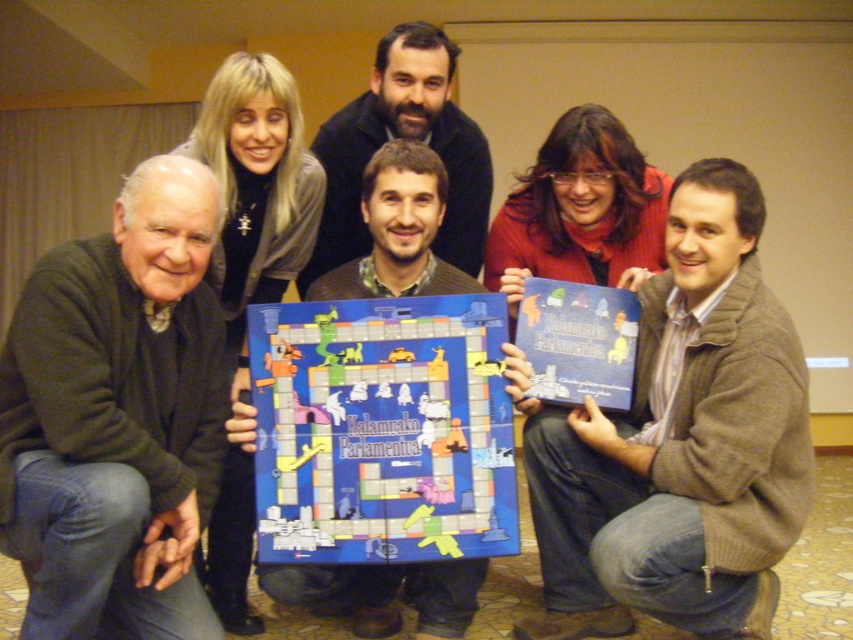
Question: Estimate the real-world distances between objects in this image. Which object is farther from the brown textured sweater at center?

Choices:
 (A) bearded man at center
 (B) dark green sweater at lower left

Answer: (A)

Question: Does dark green sweater at lower left appear over brown textured sweater at center?

Choices:
 (A) no
 (B) yes

Answer: (B)

Question: Can you confirm if brown sweater at center is positioned to the left of dark green sweater at lower left?

Choices:
 (A) no
 (B) yes

Answer: (A)

Question: Does brown textured sweater at center have a larger size compared to bearded man at center?

Choices:
 (A) yes
 (B) no

Answer: (B)

Question: Among these points, which one is nearest to the camera?

Choices:
 (A) pos(427,209)
 (B) pos(735,275)
 (C) pos(207,624)
 (D) pos(426,88)

Answer: (C)

Question: Which is nearer to the brown sweater at center?

Choices:
 (A) brown textured sweater at center
 (B) dark green sweater at lower left
 (C) bearded man at center

Answer: (A)